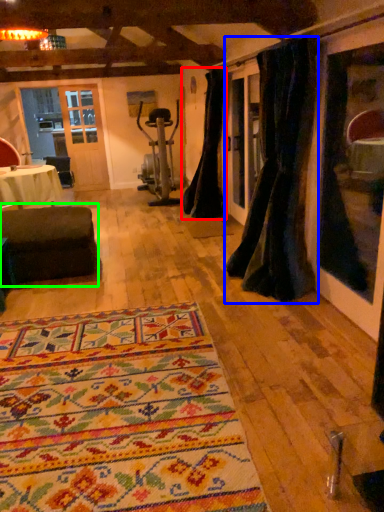
Question: Which object is the farthest from curtain (highlighted by a red box)? Choose among these: curtain (highlighted by a blue box) or studio couch (highlighted by a green box).

Choices:
 (A) curtain
 (B) studio couch

Answer: (B)